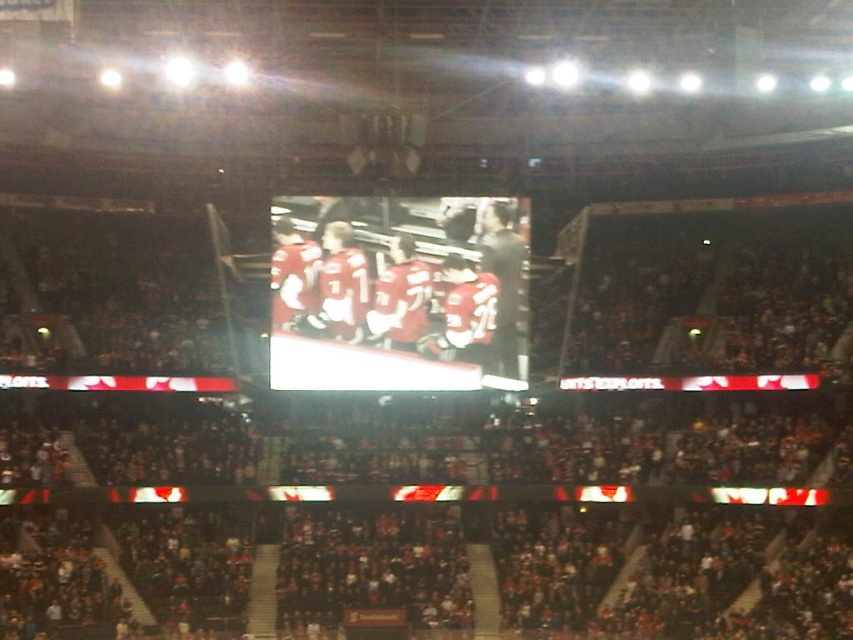
Question: Is dark gray stadium seats at center wider than matte red jersey at center?

Choices:
 (A) no
 (B) yes

Answer: (B)

Question: Does dark gray stadium seats at center have a lesser width compared to matte red jersey at center?

Choices:
 (A) yes
 (B) no

Answer: (B)

Question: Which of the following is the closest to the observer?

Choices:
 (A) dark gray stadium seats at center
 (B) matte red jersey at center

Answer: (A)

Question: Which of the following is the farthest from the observer?

Choices:
 (A) matte red jersey at center
 (B) dark gray stadium seats at center

Answer: (A)

Question: Can you confirm if dark gray stadium seats at center is smaller than matte red jersey at center?

Choices:
 (A) no
 (B) yes

Answer: (A)